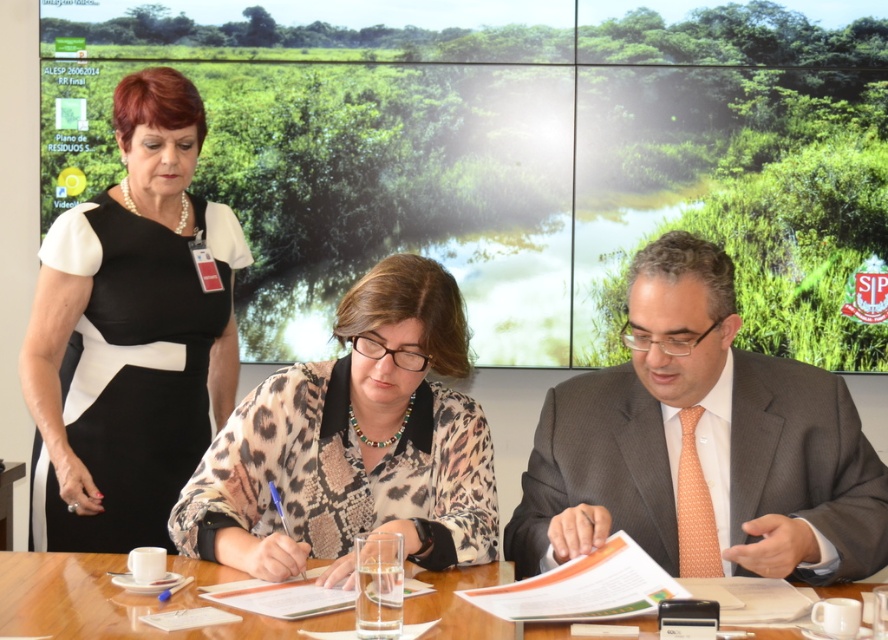
Locate an element on the screen. This screenshot has width=888, height=640. orange dotted tie at center is located at coordinates (702, 444).

Does point (799, 483) come in front of point (395, 333)?

No, (799, 483) is further to viewer.

Where is `orange dotted tie at center`? orange dotted tie at center is located at coordinates (702, 444).

Looking at this image, between orange dotted tie at center and black satin dress at upper left, which one appears on the right side from the viewer's perspective?

orange dotted tie at center is more to the right.

Is orange dotted tie at center positioned in front of black satin dress at upper left?

Yes, it is.

Measure the distance between orange dotted tie at center and camera.

orange dotted tie at center and camera are 4.72 feet apart.

The width and height of the screenshot is (888, 640). I want to click on orange dotted tie at center, so click(702, 444).

Is orange dotted tie at center positioned at the back of wooden table at center?

Yes, orange dotted tie at center is further from the viewer.

Which of these two, orange dotted tie at center or wooden table at center, stands taller?

orange dotted tie at center is taller.

Does point (744, 488) come behind point (76, 572)?

Yes.

Find the location of a particular element. Image resolution: width=888 pixels, height=640 pixels. orange dotted tie at center is located at coordinates (702, 444).